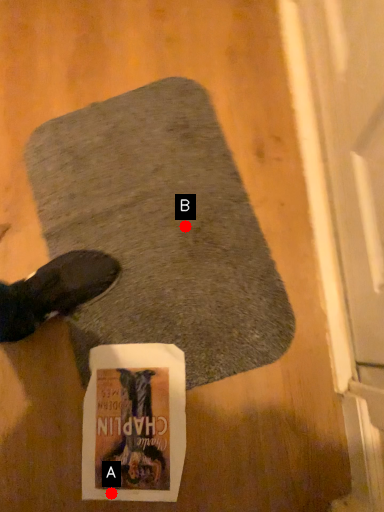
Question: Two points are circled on the image, labeled by A and B beside each circle. Which point is farther from the camera taking this photo?

Choices:
 (A) A is further
 (B) B is further

Answer: (B)